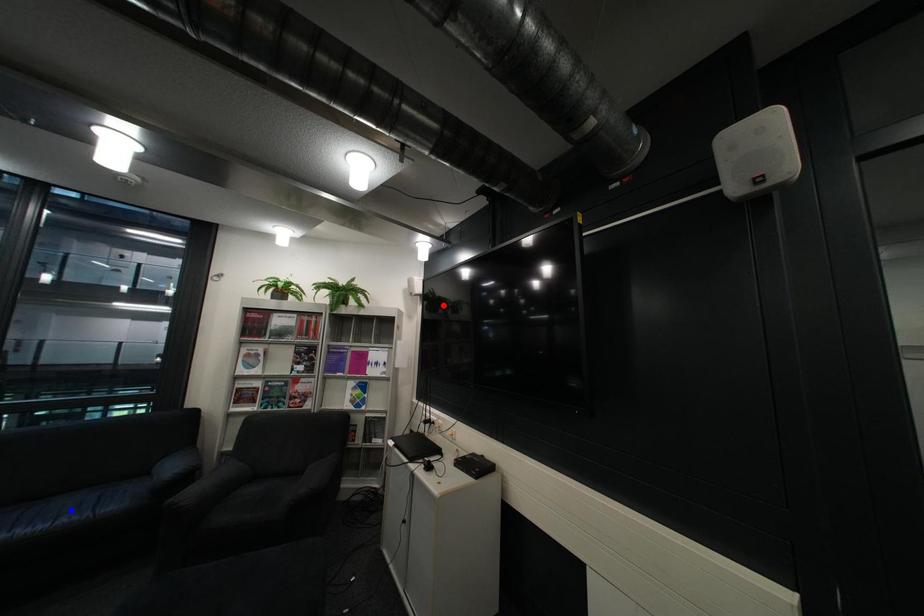
Question: In the image, two points are highlighted. Which point is nearer to the camera? Reply with the corresponding letter.

Choices:
 (A) blue point
 (B) red point

Answer: (A)